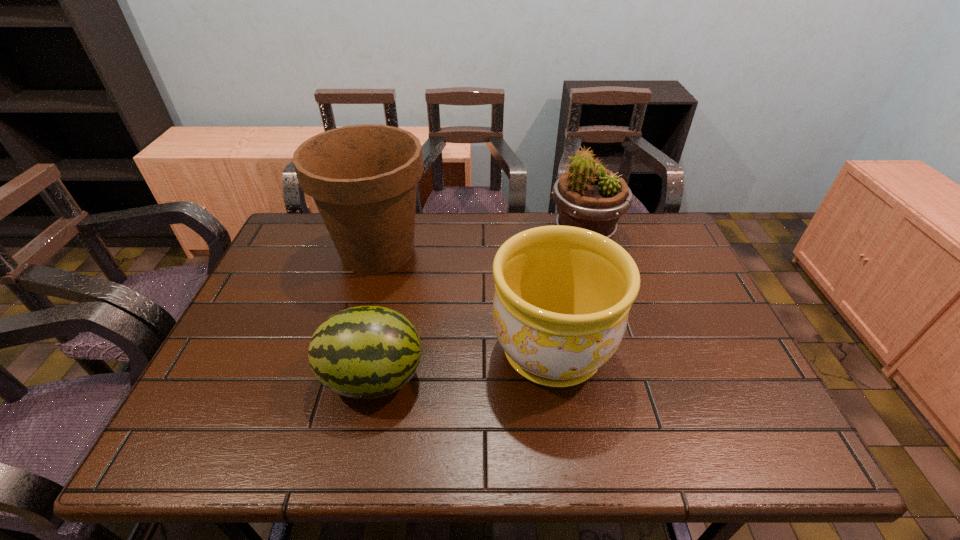
Locate an element on the screen. the closest flowerpot relative to the shortest flowerpot is located at coordinates (363, 178).

Where is `vacant region that satisfies the following two spatial constraints: 1. on the front side of the leftmost flowerpot; 2. on the left side of the nearest flowerpot`? This screenshot has height=540, width=960. vacant region that satisfies the following two spatial constraints: 1. on the front side of the leftmost flowerpot; 2. on the left side of the nearest flowerpot is located at coordinates (350, 351).

At what (x,y) coordinates should I click in order to perform the action: click on vacant space that satisfies the following two spatial constraints: 1. on the front side of the leftmost flowerpot; 2. on the left side of the shortest flowerpot. Please return your answer as a coordinate pair (x, y). This screenshot has width=960, height=540. Looking at the image, I should click on (350, 351).